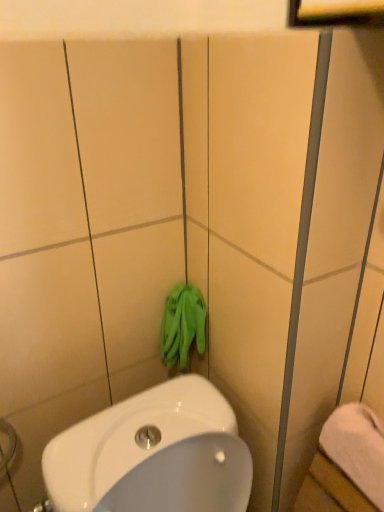
Question: Considering the positions of white soft towel at lower right and green fabric gloves at center in the image, is white soft towel at lower right bigger or smaller than green fabric gloves at center?

Choices:
 (A) small
 (B) big

Answer: (B)

Question: From the image's perspective, is white soft towel at lower right located above or below green fabric gloves at center?

Choices:
 (A) below
 (B) above

Answer: (A)

Question: From a real-world perspective, is white soft towel at lower right positioned above or below green fabric gloves at center?

Choices:
 (A) above
 (B) below

Answer: (B)

Question: From their relative heights in the image, would you say green fabric gloves at center is taller or shorter than white soft towel at lower right?

Choices:
 (A) tall
 (B) short

Answer: (A)

Question: Looking at their shapes, would you say green fabric gloves at center is wider or thinner than white soft towel at lower right?

Choices:
 (A) wide
 (B) thin

Answer: (B)

Question: Is green fabric gloves at center bigger or smaller than white soft towel at lower right?

Choices:
 (A) small
 (B) big

Answer: (A)

Question: From the image's perspective, is green fabric gloves at center above or below white soft towel at lower right?

Choices:
 (A) below
 (B) above

Answer: (B)